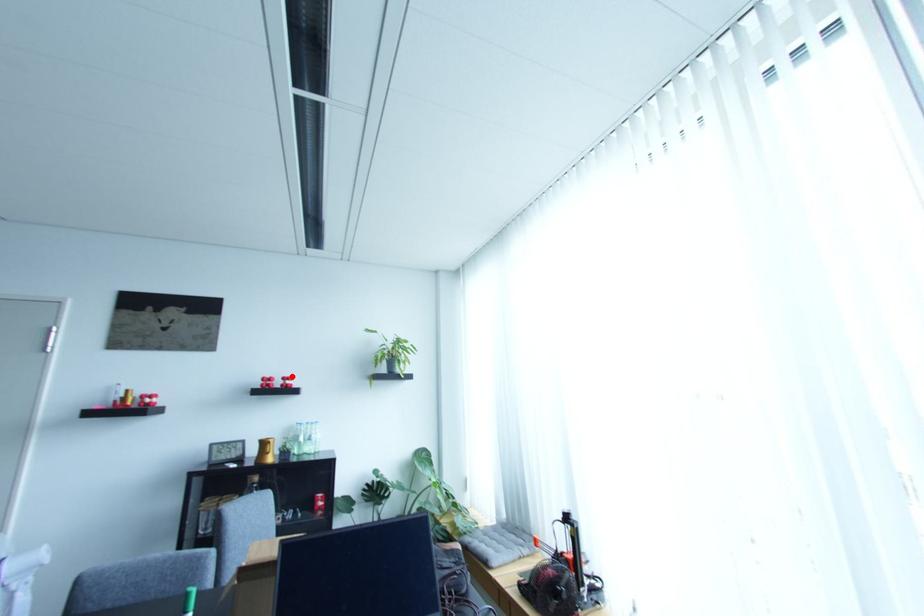
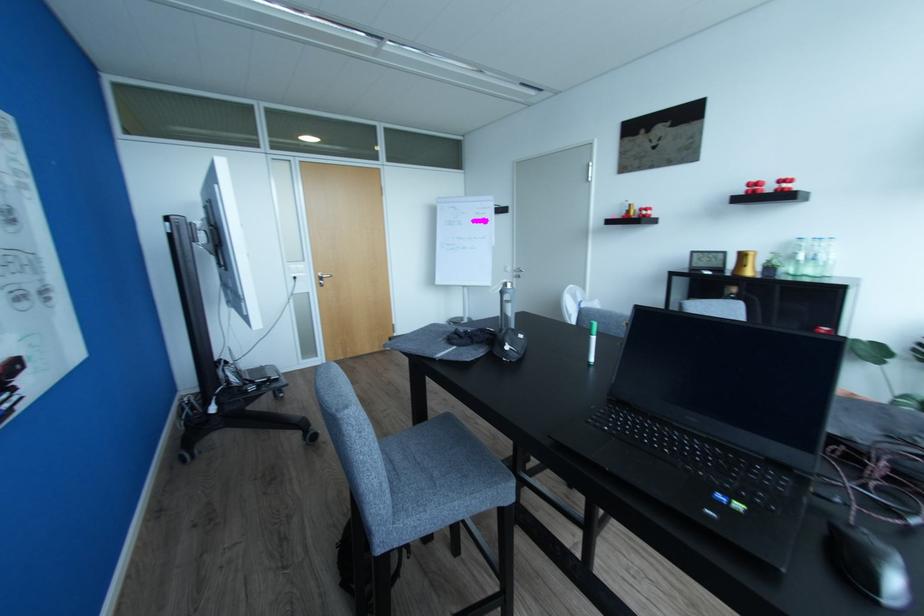
Locate, in the second image, the point that corresponds to the highlighted location in the first image.

(791, 177)